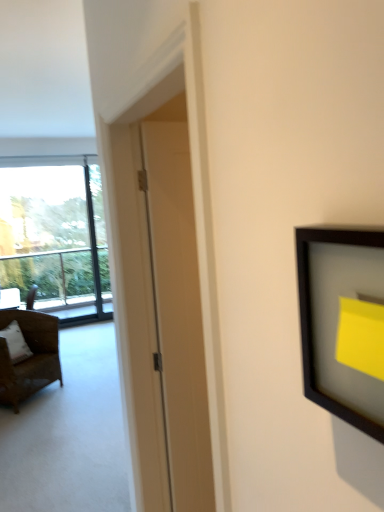
Image resolution: width=384 pixels, height=512 pixels. Describe the element at coordinates (16, 343) in the screenshot. I see `white fabric pillow at left` at that location.

Identify the location of transparent glass window at left. (55, 236).

Locate an element on the screen. This screenshot has width=384, height=512. brown wicker chair at left is located at coordinates (29, 357).

Is brown wicker chair at left wider than white fabric pillow at left?

Yes.

Can you tell me how much brown wicker chair at left and white fabric pillow at left differ in facing direction?

There is a 0.000548-degree angle between the facing directions of brown wicker chair at left and white fabric pillow at left.

Based on the photo, which of these two, brown wicker chair at left or white fabric pillow at left, stands shorter?

Standing shorter between the two is white fabric pillow at left.

Is brown wicker chair at left at the left side of white fabric pillow at left?

No, brown wicker chair at left is not to the left of white fabric pillow at left.

Is point (42, 162) positioned behind point (16, 408)?

Yes, point (42, 162) is farther from viewer.

From a real-world perspective, relative to brown wicker chair at left, is transparent glass window at left vertically above or below?

Clearly, from a real-world perspective, transparent glass window at left is above brown wicker chair at left.

Looking at this image, can you confirm if transparent glass window at left is bigger than brown wicker chair at left?

Actually, transparent glass window at left might be smaller than brown wicker chair at left.

Choose the correct answer: Is white fabric pillow at left inside brown wicker chair at left or outside it?

white fabric pillow at left exists entirely within brown wicker chair at left.

Can you see white fabric pillow at left touching brown wicker chair at left?

No, white fabric pillow at left is not touching brown wicker chair at left.

In the image, is white fabric pillow at left positioned in front of or behind brown wicker chair at left?

In the image, white fabric pillow at left appears behind brown wicker chair at left.

In terms of height, does white fabric pillow at left look taller or shorter compared to brown wicker chair at left?

Clearly, white fabric pillow at left is shorter compared to brown wicker chair at left.

Measure the distance between white matte door at center and transparent glass window at left.

white matte door at center and transparent glass window at left are 4.52 meters apart from each other.

Considering the positions of objects white matte door at center and transparent glass window at left in the image provided, who is more to the right, white matte door at center or transparent glass window at left?

From the viewer's perspective, white matte door at center appears more on the right side.

Does white matte door at center have a lesser width compared to transparent glass window at left?

Correct, the width of white matte door at center is less than that of transparent glass window at left.

Is point (162, 263) closer or farther from the camera than point (0, 181)?

Point (162, 263) is positioned closer to the camera compared to point (0, 181).

Considering the positions of objects transparent glass window at left and white fabric pillow at left in the image provided, who is more to the left, transparent glass window at left or white fabric pillow at left?

transparent glass window at left.

Does transparent glass window at left have a greater width compared to white fabric pillow at left?

No, transparent glass window at left is not wider than white fabric pillow at left.

Locate an element on the screen. pillow in front of the transparent glass window at left is located at coordinates (16, 343).

Is white matte door at center located outside brown wicker chair at left?

Indeed, white matte door at center is completely outside brown wicker chair at left.

Which object is thinner, white matte door at center or brown wicker chair at left?

With smaller width is white matte door at center.

Is white matte door at center positioned behind brown wicker chair at left?

That is False.

Identify the location of chair directly beneath the white matte door at center (from a real-world perspective). (29, 357).

Is brown wicker chair at left turned away from white matte door at center?

brown wicker chair at left is not turned away from white matte door at center.

Considering the relative sizes of brown wicker chair at left and white matte door at center in the image provided, is brown wicker chair at left bigger than white matte door at center?

Correct, brown wicker chair at left is larger in size than white matte door at center.

What's the angular difference between brown wicker chair at left and white matte door at center's facing directions?

38.4 degrees.

In terms of width, does brown wicker chair at left look wider or thinner when compared to white matte door at center?

Considering their sizes, brown wicker chair at left looks broader than white matte door at center.

This screenshot has height=512, width=384. I want to click on chair that appears on the right of white fabric pillow at left, so click(29, 357).

In the image, there is a transparent glass window at left. What are the coordinates of `chair below it (from the image's perspective)` in the screenshot? It's located at (29, 357).

From the image, which object appears to be nearer to brown wicker chair at left, white fabric pillow at left or transparent glass window at left?

white fabric pillow at left is positioned closer to the anchor brown wicker chair at left.

Which object lies nearer to the anchor point transparent glass window at left, white matte door at center or white fabric pillow at left?

white fabric pillow at left is closer to transparent glass window at left.

Estimate the real-world distances between objects in this image. Which object is further from transparent glass window at left, brown wicker chair at left or white fabric pillow at left?

Based on the image, white fabric pillow at left appears to be further to transparent glass window at left.

Looking at the image, which one is located closer to white fabric pillow at left, transparent glass window at left or brown wicker chair at left?

Based on the image, brown wicker chair at left appears to be nearer to white fabric pillow at left.

Looking at the image, which one is located closer to transparent glass window at left, white fabric pillow at left or white matte door at center?

white fabric pillow at left is closer to transparent glass window at left.

When comparing their distances from white matte door at center, does white fabric pillow at left or transparent glass window at left seem further?

transparent glass window at left lies further to white matte door at center than the other object.

Looking at the image, which one is located closer to transparent glass window at left, white matte door at center or brown wicker chair at left?

brown wicker chair at left is positioned closer to the anchor transparent glass window at left.

Which object lies nearer to the anchor point transparent glass window at left, white fabric pillow at left or brown wicker chair at left?

The object closer to transparent glass window at left is brown wicker chair at left.

The image size is (384, 512). What are the coordinates of `chair between white matte door at center and white fabric pillow at left from front to back` in the screenshot? It's located at (29, 357).

Find the location of a particular element. This screenshot has height=512, width=384. pillow between white matte door at center and transparent glass window at left in the front-back direction is located at coordinates (16, 343).

Locate an element on the screen. This screenshot has height=512, width=384. chair between white matte door at center and transparent glass window at left along the z-axis is located at coordinates (29, 357).

Image resolution: width=384 pixels, height=512 pixels. In order to click on pillow positioned between brown wicker chair at left and transparent glass window at left from near to far in this screenshot , I will do 16,343.